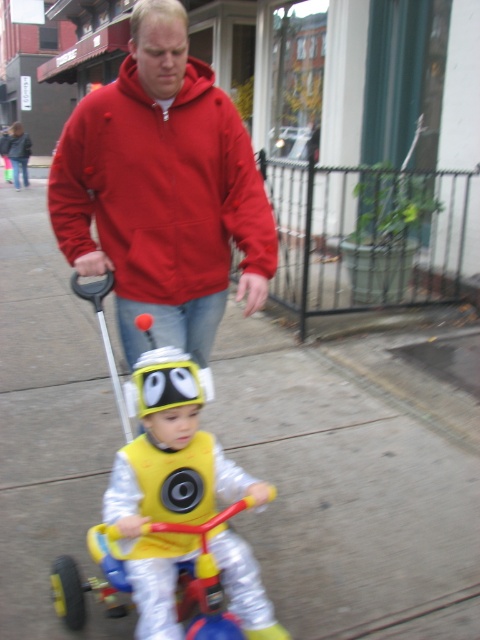
You are a pedestrian standing on the sidewalk and see the matte red jacket at upper center and the yellow plastic tricycle at center. Which object is higher in the image?

The matte red jacket at upper center is above the yellow plastic tricycle at center in the image.

You are a delivery person who needs to deliver a package to the address marked at point (162,188). You see the matte red jacket at upper center there. Is the address located above or below the matte red jacket at upper center?

The address is located at the same position as the matte red jacket at upper center, so they are at the same level.

You are standing at the point with coordinates point (x=183, y=284) and want to walk towards the point with coordinates point (x=249, y=401). Will you be moving closer to or farther from the camera?

Since point (x=249, y=401) is further to the camera than point (x=183, y=284), moving towards it means you will be moving closer to the camera.